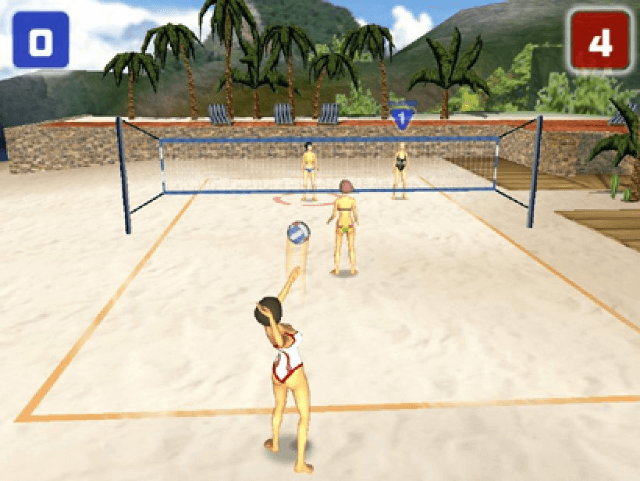
Image resolution: width=640 pixels, height=481 pixels. I want to click on wooden planks, so click(621, 228), click(550, 182).